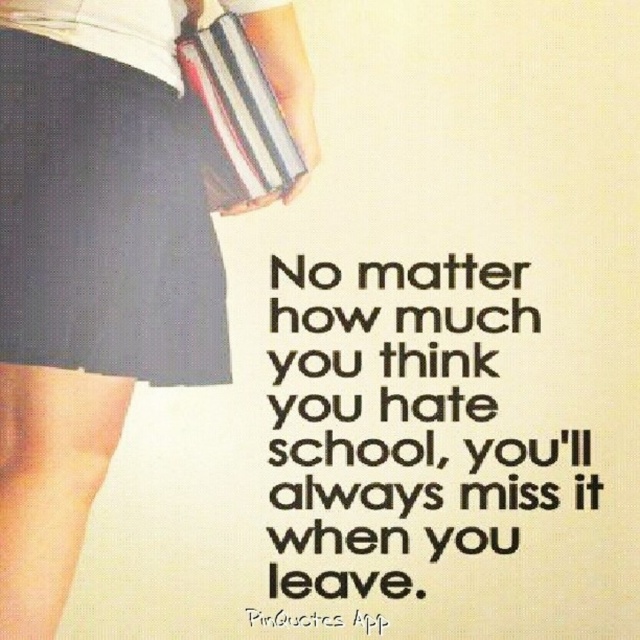
Question: Is matte black skirt at lower left wider than black paper text at center?

Choices:
 (A) no
 (B) yes

Answer: (A)

Question: Can you confirm if matte black skirt at lower left is thinner than dark blue fabric skirt at lower left?

Choices:
 (A) no
 (B) yes

Answer: (A)

Question: Can you confirm if black paper text at center is positioned to the right of matte black pencil skirt at upper left?

Choices:
 (A) no
 (B) yes

Answer: (B)

Question: Among these objects, which one is nearest to the camera?

Choices:
 (A) matte black skirt at lower left
 (B) black paper text at center
 (C) dark blue fabric skirt at lower left
 (D) matte black pencil skirt at upper left

Answer: (A)

Question: Which of these objects is positioned closest to the matte black skirt at lower left?

Choices:
 (A) matte black pencil skirt at upper left
 (B) black paper text at center

Answer: (A)

Question: Among these points, which one is farthest from the camera?

Choices:
 (A) pyautogui.click(x=166, y=340)
 (B) pyautogui.click(x=196, y=77)

Answer: (A)